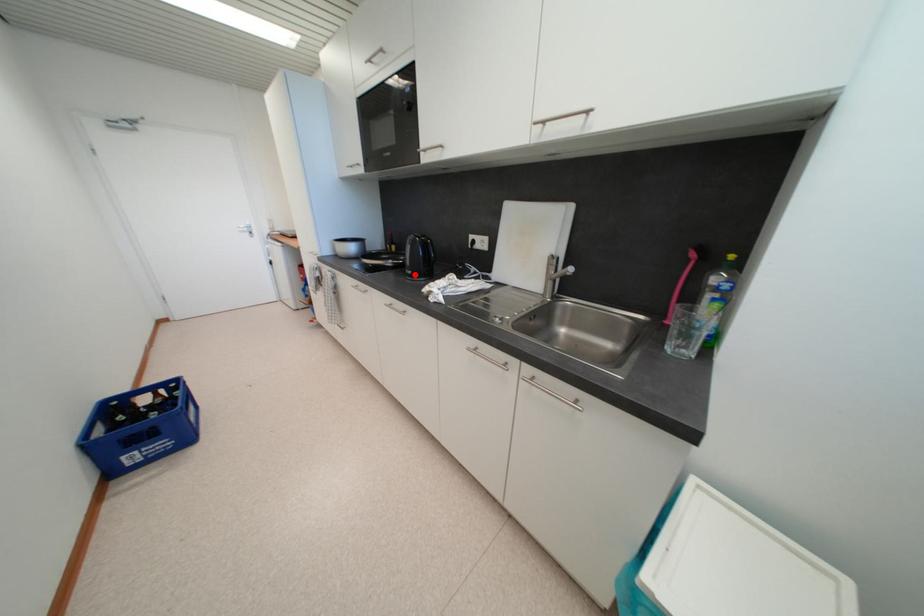
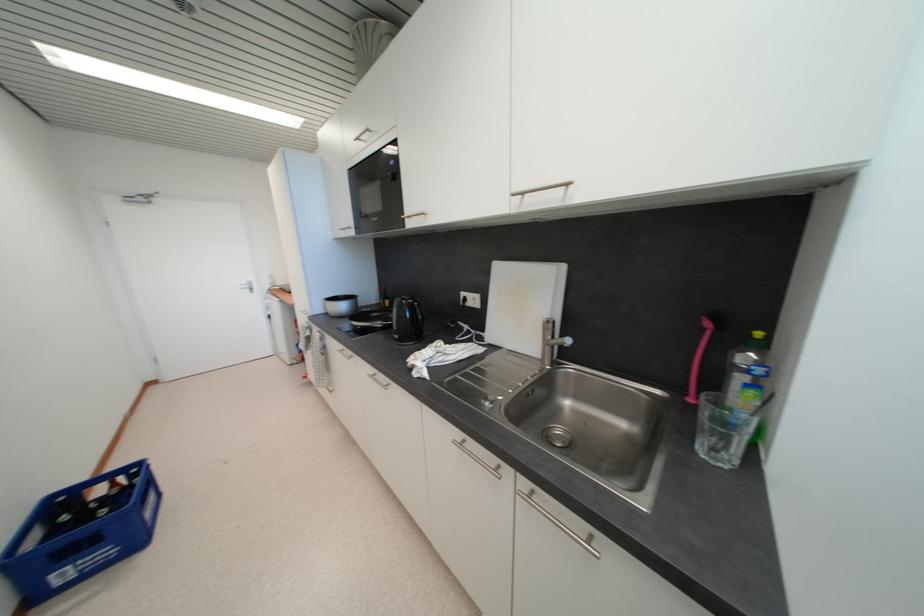
Find the pixel in the second image that matches the highlighted location in the first image.

(402, 339)